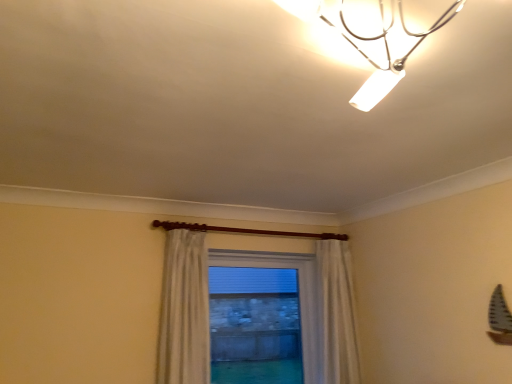
Question: Is clear glass window at center bigger or smaller than metallic chrome lamp at upper center?

Choices:
 (A) small
 (B) big

Answer: (B)

Question: In terms of height, does clear glass window at center look taller or shorter compared to metallic chrome lamp at upper center?

Choices:
 (A) short
 (B) tall

Answer: (B)

Question: Which is farther from the white sheer curtain at center?

Choices:
 (A) metallic chrome lamp at upper center
 (B) clear glass window at center

Answer: (B)

Question: Estimate the real-world distances between objects in this image. Which object is farther from the clear glass window at center?

Choices:
 (A) metallic chrome lamp at upper center
 (B) white sheer curtain at center

Answer: (A)